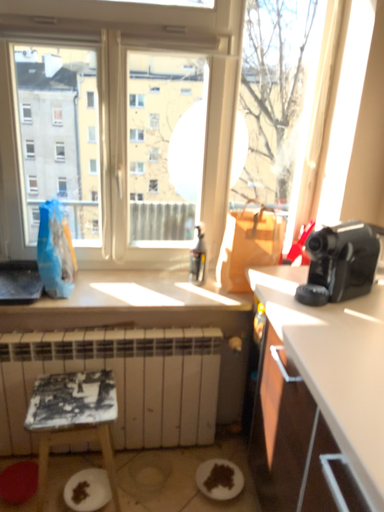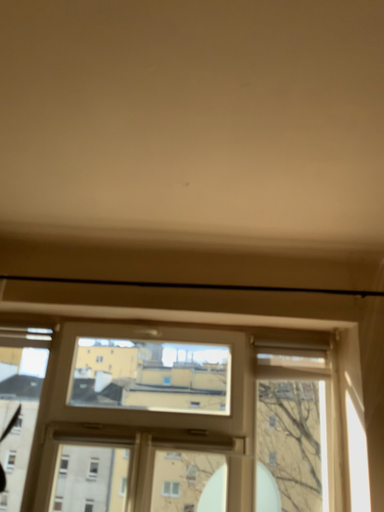
Question: How did the camera likely rotate when shooting the video?

Choices:
 (A) rotated downward
 (B) rotated upward

Answer: (B)